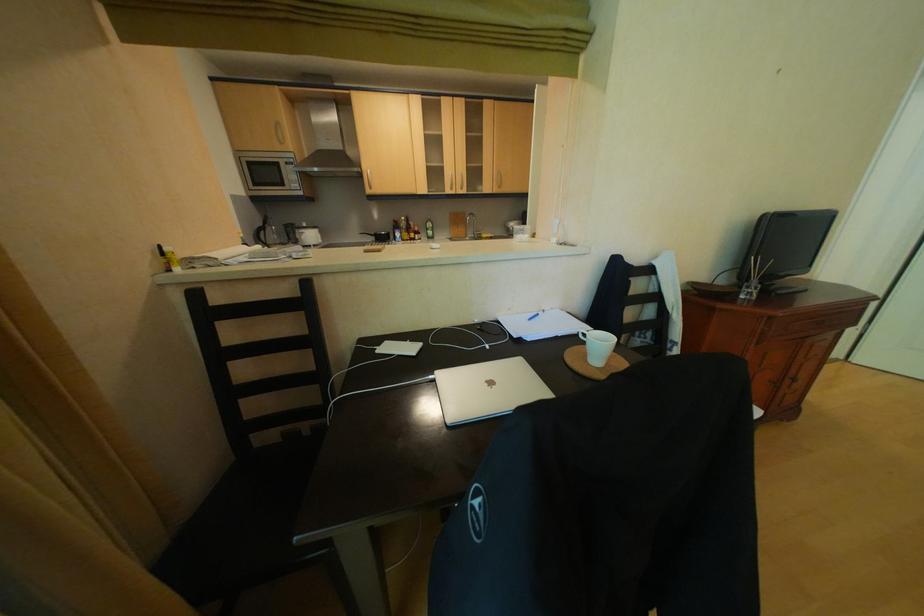
You are a GUI agent. You are given a task and a screenshot of the screen. Output one action in this format:
    pyautogui.click(x=<x>, y=<y>)
    Task: Click on the pan handle
    The width and height of the screenshot is (924, 616).
    Given the screenshot: What is the action you would take?
    pyautogui.click(x=375, y=241)